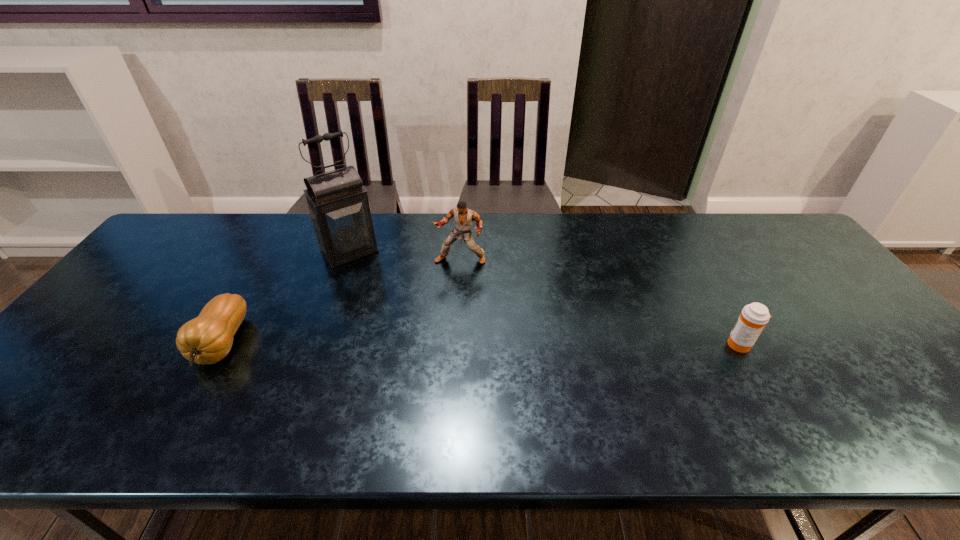
Where is `vacant spot on the desktop that is between the gourd and the rightmost object and is positioned on the front-facing side of the third shortest object`? vacant spot on the desktop that is between the gourd and the rightmost object and is positioned on the front-facing side of the third shortest object is located at coordinates (421, 344).

The width and height of the screenshot is (960, 540). What are the coordinates of `free space on the desktop that is between the gourd and the medicine and is positioned on the front-facing side of the lantern` in the screenshot? It's located at (419, 344).